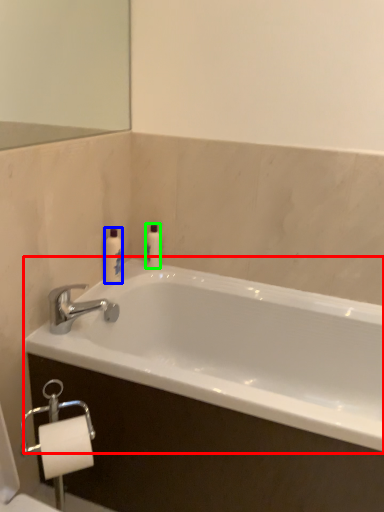
Question: Considering the real-world distances, which object is closest to bathtub (highlighted by a red box)? toiletry (highlighted by a blue box) or toiletry (highlighted by a green box).

Choices:
 (A) toiletry
 (B) toiletry

Answer: (B)